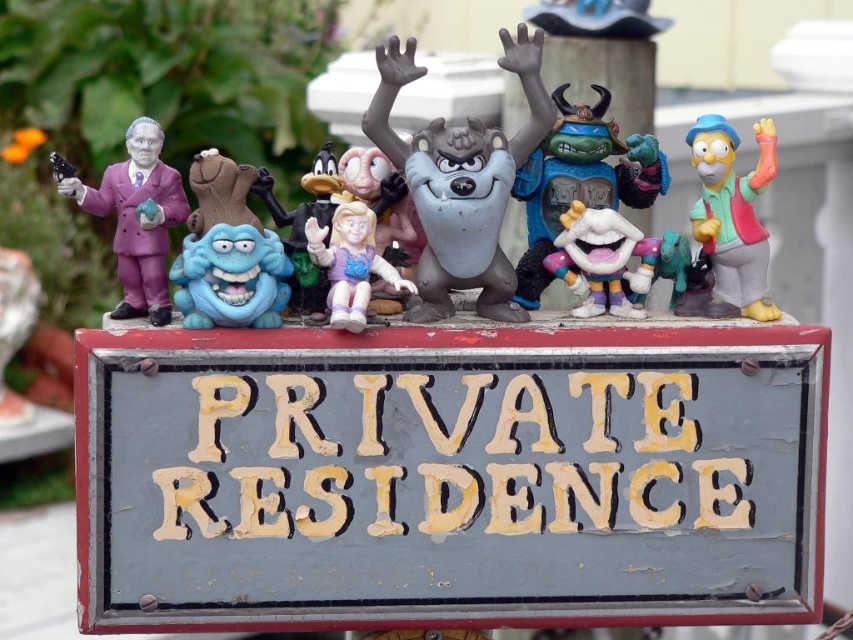
Question: Observing the image, what is the correct spatial positioning of white matte clown at center in reference to matte plastic doll at center?

Choices:
 (A) above
 (B) below

Answer: (A)

Question: In this image, where is matte plastic figurine at right located relative to white matte clown at center?

Choices:
 (A) left
 (B) right

Answer: (B)

Question: Based on their relative distances, which object is nearer to the matte purple suit at left?

Choices:
 (A) white matte clown at center
 (B) gray painted wood at center

Answer: (B)

Question: Which of these objects is positioned closest to the matte plastic figure at center?

Choices:
 (A) matte plastic doll at center
 (B) blue rubber monster at center

Answer: (A)

Question: Which point is farther from the camera taking this photo?

Choices:
 (A) (381, 621)
 (B) (619, 310)
 (C) (126, 275)
 (D) (209, 288)

Answer: (B)

Question: Where is matte gray wolf at center located in relation to matte purple suit at left in the image?

Choices:
 (A) below
 (B) above

Answer: (B)